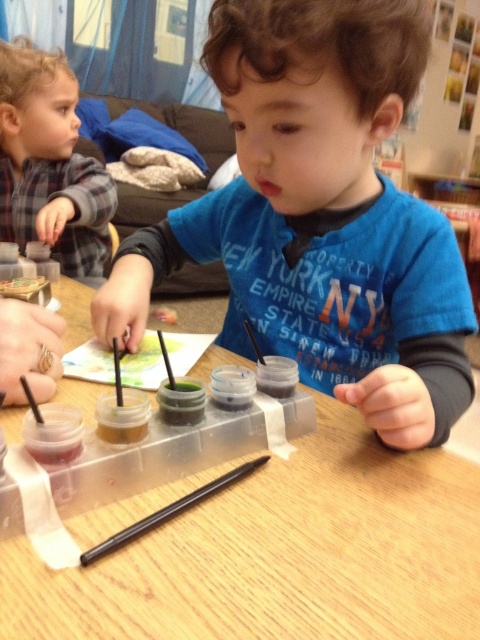
Question: Can you confirm if blue matte shirt at center is wider than plaid flannel shirt at upper left?

Choices:
 (A) yes
 (B) no

Answer: (A)

Question: Estimate the real-world distances between objects in this image. Which object is closer to the plaid flannel shirt at upper left?

Choices:
 (A) black plastic crayon at center
 (B) blue matte shirt at center
 (C) wooden table at center

Answer: (C)

Question: Which is farther from the wooden table at center?

Choices:
 (A) plaid flannel shirt at upper left
 (B) black plastic crayon at center
 (C) blue matte shirt at center

Answer: (A)

Question: Is plaid flannel shirt at upper left bigger than black plastic crayon at center?

Choices:
 (A) no
 (B) yes

Answer: (B)

Question: Which of the following is the farthest from the observer?

Choices:
 (A) 74,154
 (B) 120,540
 (C) 118,516
 (D) 372,60

Answer: (A)

Question: Is plaid flannel shirt at upper left positioned behind black plastic crayon at center?

Choices:
 (A) no
 (B) yes

Answer: (B)